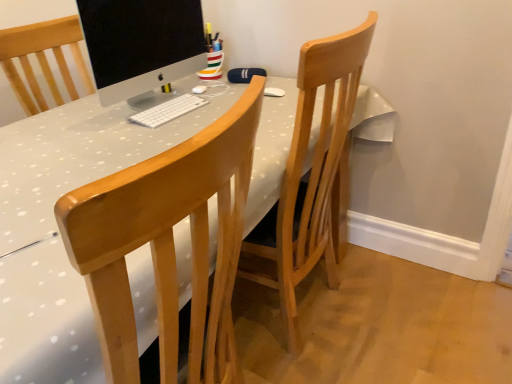
Question: From the image's perspective, is white matte keyboard at center on top of wooden chair at center?

Choices:
 (A) no
 (B) yes

Answer: (B)

Question: Is white matte keyboard at center next to wooden chair at center and touching it?

Choices:
 (A) yes
 (B) no

Answer: (B)

Question: Can you confirm if white matte keyboard at center is positioned to the right of wooden chair at center?

Choices:
 (A) no
 (B) yes

Answer: (A)

Question: Is wooden chair at center at the back of white matte keyboard at center?

Choices:
 (A) no
 (B) yes

Answer: (A)

Question: Can you confirm if white matte keyboard at center is taller than wooden chair at center?

Choices:
 (A) yes
 (B) no

Answer: (B)

Question: Is white matte keyboard at center inside or outside of wooden chair at center?

Choices:
 (A) inside
 (B) outside

Answer: (B)

Question: From the image's perspective, is white matte keyboard at center above or below wooden chair at center?

Choices:
 (A) below
 (B) above

Answer: (B)

Question: Does point (187, 97) appear closer or farther from the camera than point (166, 170)?

Choices:
 (A) closer
 (B) farther

Answer: (B)

Question: Considering the positions of white matte keyboard at center and wooden chair at center in the image, is white matte keyboard at center wider or thinner than wooden chair at center?

Choices:
 (A) wide
 (B) thin

Answer: (B)

Question: From the image's perspective, is white matte keyboard at center above or below sleek silver monitor at center?

Choices:
 (A) below
 (B) above

Answer: (A)

Question: From a real-world perspective, is white matte keyboard at center physically located above or below sleek silver monitor at center?

Choices:
 (A) below
 (B) above

Answer: (A)

Question: From their relative heights in the image, would you say white matte keyboard at center is taller or shorter than sleek silver monitor at center?

Choices:
 (A) tall
 (B) short

Answer: (B)

Question: Looking at the image, does white matte keyboard at center seem bigger or smaller compared to sleek silver monitor at center?

Choices:
 (A) small
 (B) big

Answer: (A)

Question: Based on their positions, is sleek silver monitor at center located to the left or right of wooden chair at center?

Choices:
 (A) left
 (B) right

Answer: (A)

Question: From the image's perspective, is sleek silver monitor at center located above or below wooden chair at center?

Choices:
 (A) above
 (B) below

Answer: (A)